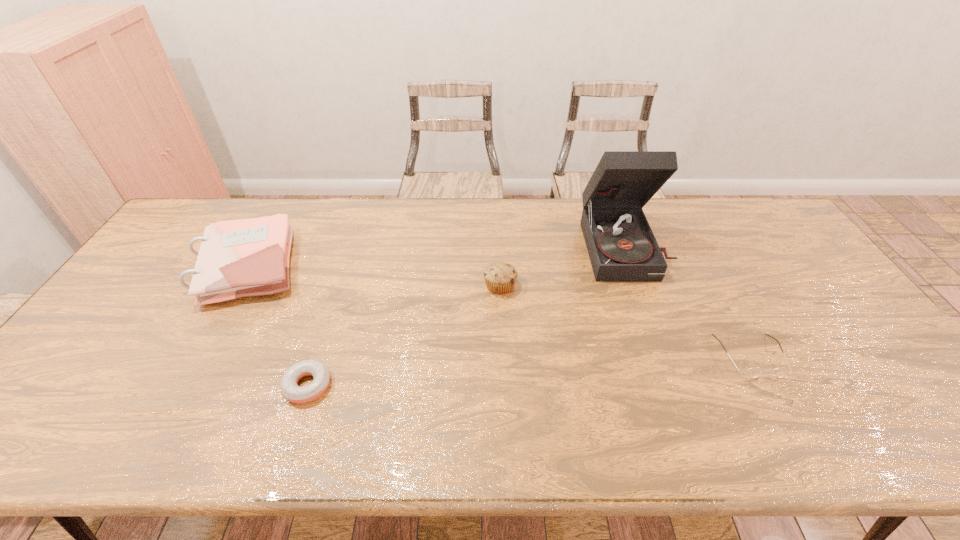
Locate an element on the screen. blank area located 0.150m through the lenses of the rightmost object is located at coordinates pos(794,439).

Find the location of `vacant area located on the left of the shortest object`. vacant area located on the left of the shortest object is located at coordinates (120, 386).

In order to click on phonograph_record present at the far edge in this screenshot , I will do `click(621, 245)`.

Identify the location of phonebook that is at the far edge. (249, 257).

Locate an element on the screen. Image resolution: width=960 pixels, height=540 pixels. object that is at the left edge is located at coordinates (249, 257).

You are a GUI agent. You are given a task and a screenshot of the screen. Output one action in this format:
    pyautogui.click(x=<x>, y=<y>)
    Task: Click on the object located at the far left corner
    This screenshot has height=540, width=960.
    Given the screenshot: What is the action you would take?
    pyautogui.click(x=249, y=257)

In the image, there is a desktop. Where is `vacant space at the far edge`? vacant space at the far edge is located at coordinates (410, 224).

Identify the location of free region at the left edge of the desktop. (131, 301).

In the image, there is a desktop. Identify the location of free space at the right edge. (812, 332).

Image resolution: width=960 pixels, height=540 pixels. I want to click on free region at the far left corner, so click(x=234, y=198).